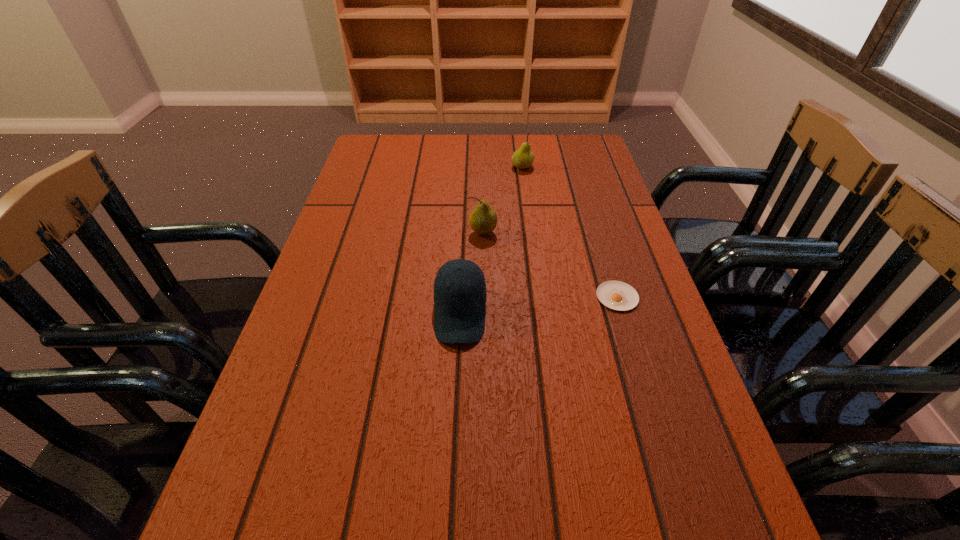
Locate an element on the screen. This screenshot has width=960, height=540. free space between the farther pear and the baseball cap is located at coordinates (492, 240).

Where is `vacant area that lies between the shortest object and the baseball cap`? The width and height of the screenshot is (960, 540). vacant area that lies between the shortest object and the baseball cap is located at coordinates (539, 305).

Find the location of `vacant space in between the shortest object and the baseball cap`. vacant space in between the shortest object and the baseball cap is located at coordinates (539, 305).

The image size is (960, 540). Identify the location of free spot between the third object from left to right and the baseball cap. (492, 240).

The image size is (960, 540). Identify the location of the third closest object to the nearer pear. (522, 158).

Locate an element on the screen. The width and height of the screenshot is (960, 540). object that is the closest to the nearer pear is located at coordinates (460, 296).